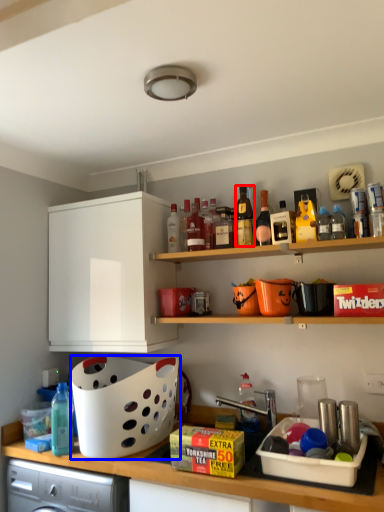
Question: Which object is further to the camera taking this photo, bottle (highlighted by a red box) or basket (highlighted by a blue box)?

Choices:
 (A) bottle
 (B) basket

Answer: (A)